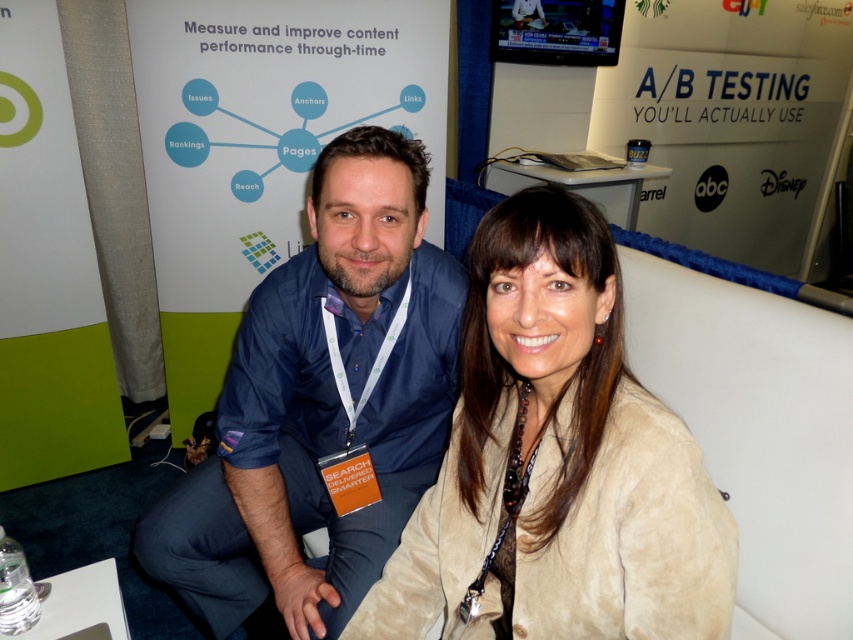
Is point (604, 628) in front of point (167, 548)?

Yes, it is in front of point (167, 548).

Between beige suede jacket at center and blue cotton shirt at center, which one appears on the right side from the viewer's perspective?

Positioned to the right is beige suede jacket at center.

Who is more forward, (544, 387) or (390, 321)?

Point (544, 387) is more forward.

Find the location of `beige suede jacket at center`. beige suede jacket at center is located at coordinates (556, 461).